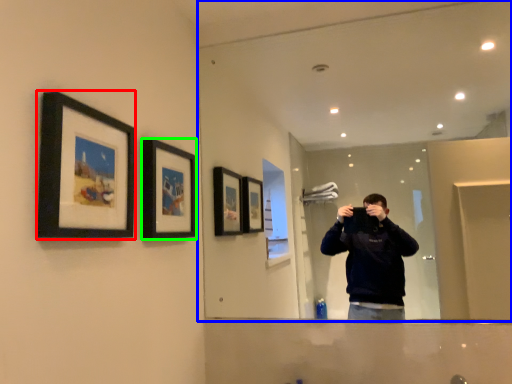
Question: Estimate the real-world distances between objects in this image. Which object is closer to picture frame (highlighted by a red box), mirror (highlighted by a blue box) or picture frame (highlighted by a green box)?

Choices:
 (A) mirror
 (B) picture frame

Answer: (B)